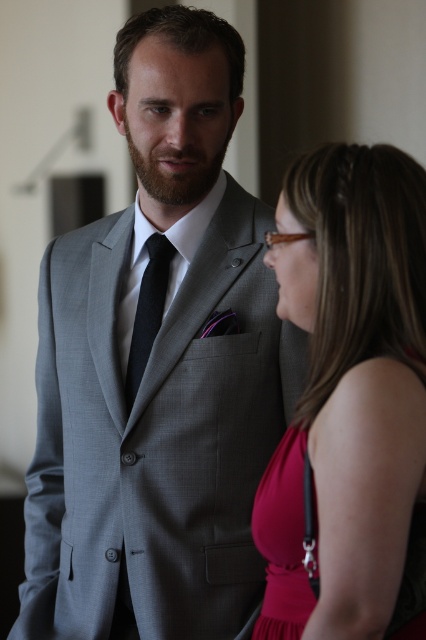
Question: Which of the following is the closest to the observer?

Choices:
 (A) matte pink fabric dress at lower right
 (B) matte gray suit at center

Answer: (A)

Question: Observing the image, what is the correct spatial positioning of matte gray suit at center in reference to matte pink fabric dress at lower right?

Choices:
 (A) left
 (B) right

Answer: (A)

Question: Which is farther from the matte pink dress at right?

Choices:
 (A) black silk tie at center
 (B) matte pink fabric dress at lower right

Answer: (A)

Question: Which of these objects is positioned closest to the matte gray suit at center?

Choices:
 (A) matte pink fabric dress at lower right
 (B) black silk tie at center

Answer: (B)

Question: Does matte gray suit at center have a smaller size compared to black silk tie at center?

Choices:
 (A) no
 (B) yes

Answer: (A)

Question: Is matte pink fabric dress at lower right further to the viewer compared to black silk tie at center?

Choices:
 (A) yes
 (B) no

Answer: (B)